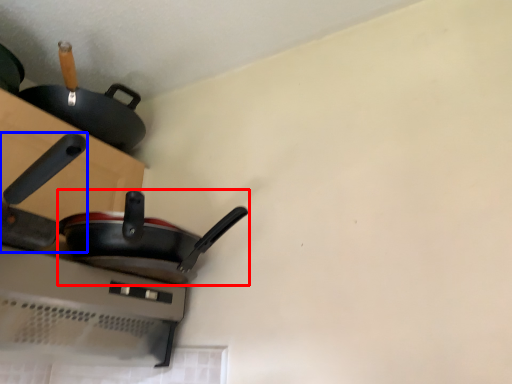
Question: Among these objects, which one is farthest to the camera, frying pan (highlighted by a red box) or frying pan (highlighted by a blue box)?

Choices:
 (A) frying pan
 (B) frying pan

Answer: (A)